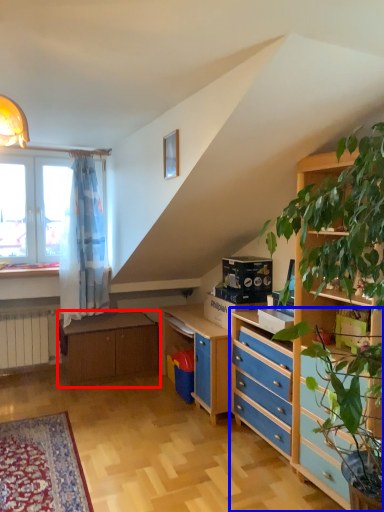
Question: Which object is closer to the camera taking this photo, table (highlighted by a red box) or chest of drawers (highlighted by a blue box)?

Choices:
 (A) table
 (B) chest of drawers

Answer: (B)